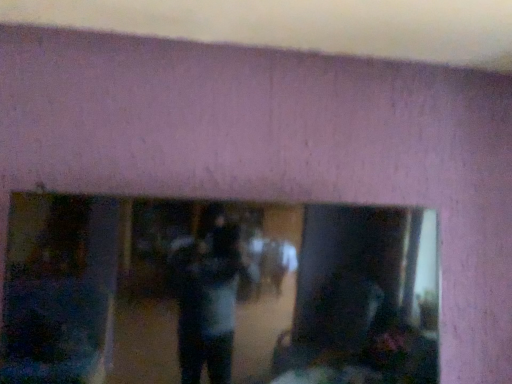
The height and width of the screenshot is (384, 512). What are the coordinates of `matte glass mirror at center` in the screenshot? It's located at (217, 293).

This screenshot has height=384, width=512. What do you see at coordinates (217, 293) in the screenshot? I see `matte glass mirror at center` at bounding box center [217, 293].

Where is `matte glass mirror at center`? matte glass mirror at center is located at coordinates (217, 293).